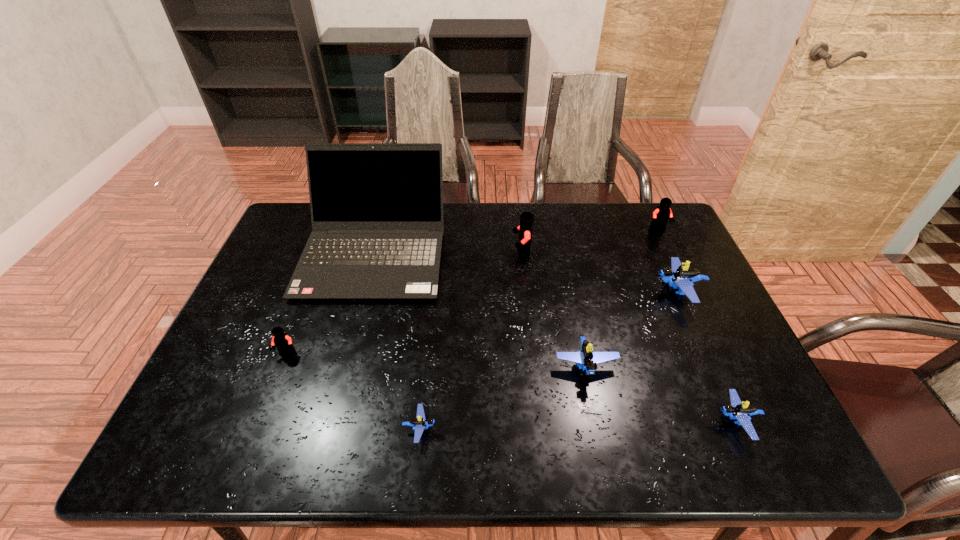
Image resolution: width=960 pixels, height=540 pixels. I want to click on black laptop computer, so click(376, 208).

Where is `laptop computer`? Image resolution: width=960 pixels, height=540 pixels. laptop computer is located at coordinates (376, 208).

In order to click on the fifth Lego from right to left in this screenshot , I will do `click(526, 218)`.

Identify the location of the tallest Lego. The width and height of the screenshot is (960, 540). (526, 218).

Image resolution: width=960 pixels, height=540 pixels. Find the location of `the farthest black Lego`. the farthest black Lego is located at coordinates pos(661,215).

Identify the location of the rightmost black Lego. This screenshot has height=540, width=960. (661, 215).

At what (x,y) coordinates should I click in order to perform the action: click on the biggest blue Lego. Please return your answer as a coordinate pair (x, y). Looking at the image, I should click on (680, 277).

I want to click on the third farthest Lego, so click(x=680, y=277).

This screenshot has width=960, height=540. I want to click on the third blue Lego from right to left, so click(586, 359).

Image resolution: width=960 pixels, height=540 pixels. I want to click on the fourth Lego from left to right, so click(586, 359).